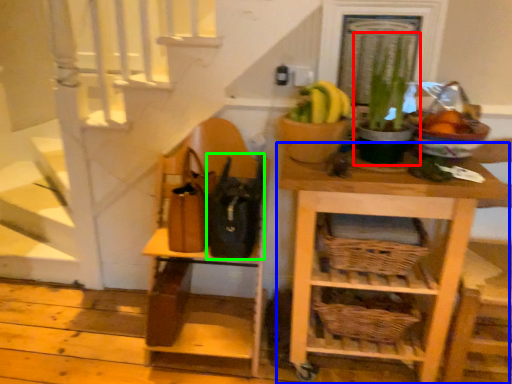
Question: Which object is positioned farthest from houseplant (highlighted by a red box)? Select from shelf (highlighted by a blue box) and bag (highlighted by a green box).

Choices:
 (A) shelf
 (B) bag

Answer: (B)